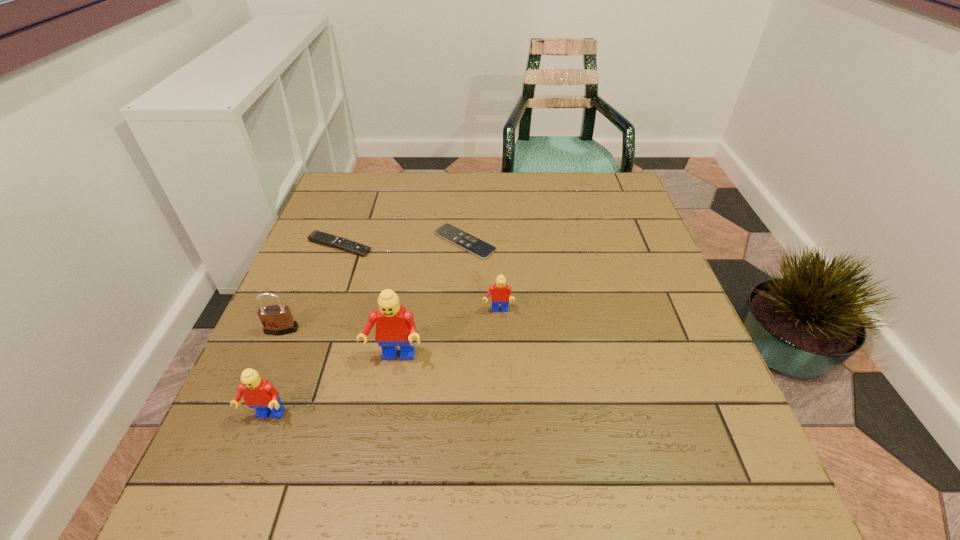
Please point a vacant point for placing a Lego on the right. Please provide its 2D coordinates. Your answer should be formatted as a tuple, i.e. [(x, y)], where the tuple contains the x and y coordinates of a point satisfying the conditions above.

[(584, 272)]